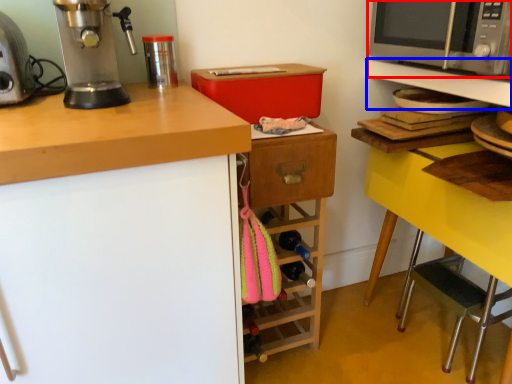
Question: Which object is further to the camera taking this photo, microwave oven (highlighted by a red box) or shelf (highlighted by a blue box)?

Choices:
 (A) microwave oven
 (B) shelf

Answer: (B)